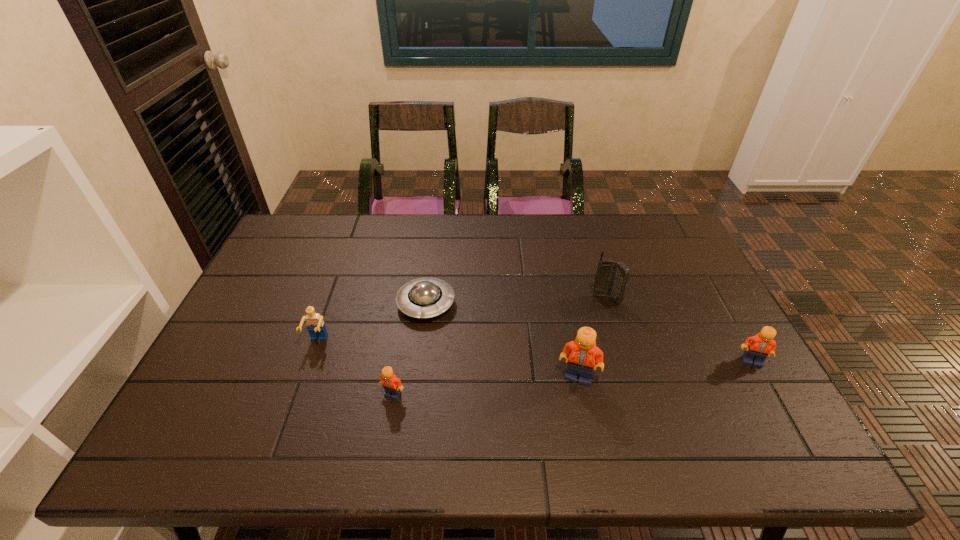
What are the coordinates of `vacant area that lies between the third object from right to left and the rightmost object` in the screenshot? It's located at (665, 369).

The width and height of the screenshot is (960, 540). In order to click on empty space that is in between the fourth object from left to right and the shortest object in this screenshot , I will do `click(502, 340)`.

Where is `blank region between the shortest object and the leftmost object`? This screenshot has width=960, height=540. blank region between the shortest object and the leftmost object is located at coordinates (372, 322).

I want to click on free space between the saucer and the leftmost object, so click(x=372, y=322).

Find the location of a particular element. This screenshot has width=960, height=540. vacant area that lies between the cellular telephone and the farthest Lego is located at coordinates (462, 320).

The height and width of the screenshot is (540, 960). Identify the location of free area in between the saucer and the tallest Lego. (502, 340).

Locate an element on the screen. vacant area that lies between the nearest Lego and the saucer is located at coordinates (409, 349).

Identify the location of empty space between the saucer and the leftmost object. (372, 322).

Select which object appears as the second closest to the tallest Lego. Please provide its 2D coordinates. Your answer should be formatted as a tuple, i.e. [(x, y)], where the tuple contains the x and y coordinates of a point satisfying the conditions above.

[(425, 297)]

Choose which object is the third nearest neighbor to the second Lego from left to right. Please provide its 2D coordinates. Your answer should be formatted as a tuple, i.e. [(x, y)], where the tuple contains the x and y coordinates of a point satisfying the conditions above.

[(582, 353)]